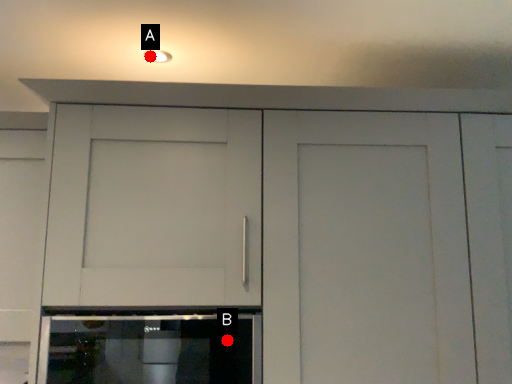
Question: Two points are circled on the image, labeled by A and B beside each circle. Which of the following is the farthest from the observer?

Choices:
 (A) A is further
 (B) B is further

Answer: (A)